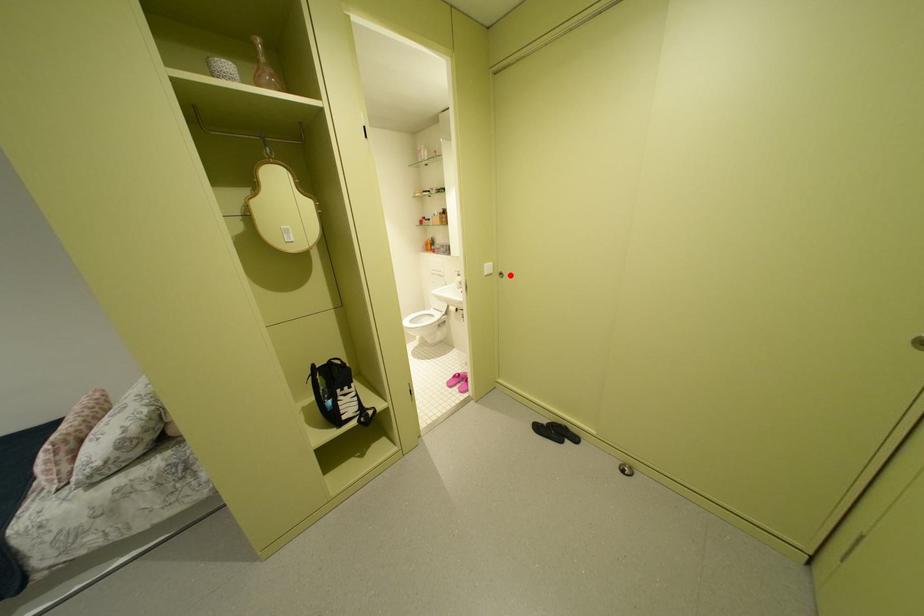
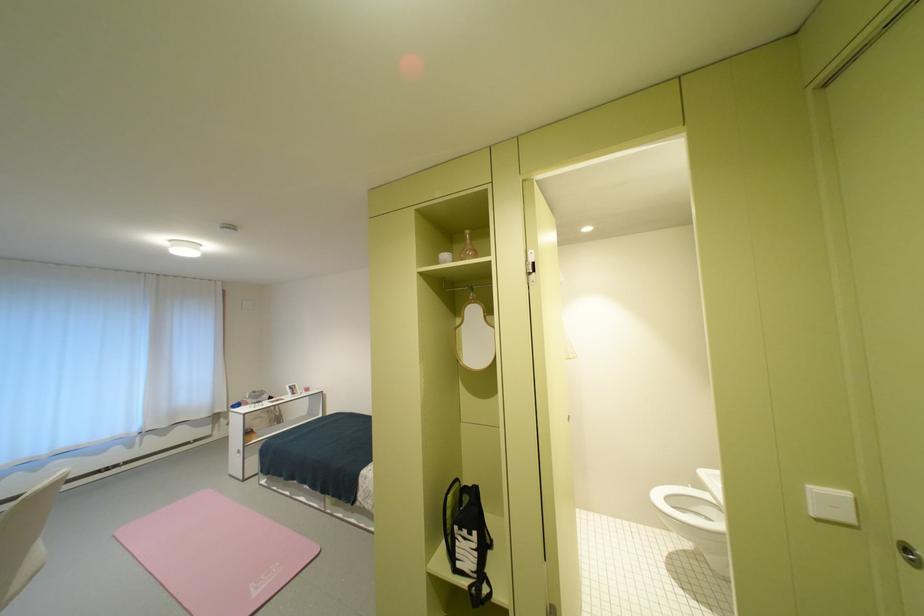
Locate, in the second image, the point that corresponds to the highlighted location in the first image.

(917, 551)